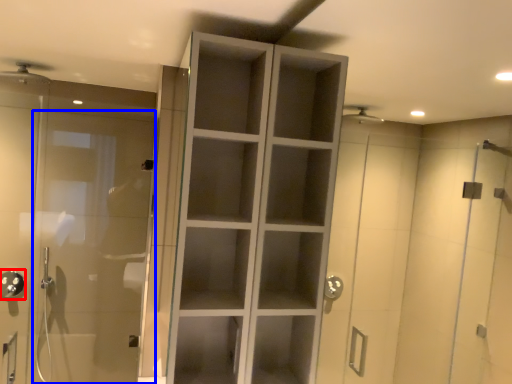
Question: Which point is further to the camera, shower (highlighted by a red box) or door (highlighted by a blue box)?

Choices:
 (A) shower
 (B) door

Answer: (A)